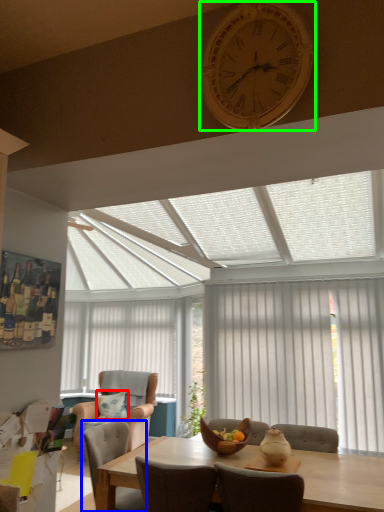
Question: Which object is positioned closest to pillow (highlighted by a red box)? Select from chair (highlighted by a blue box) and clock (highlighted by a green box).

Choices:
 (A) chair
 (B) clock

Answer: (A)